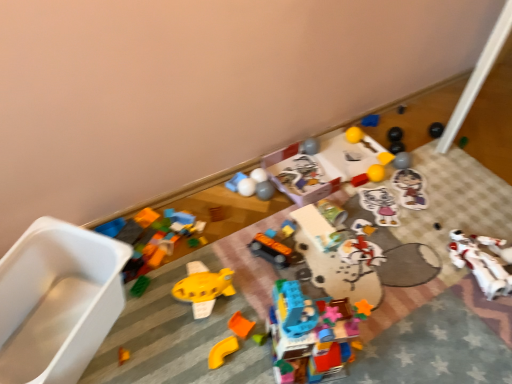
You are a GUI agent. You are given a task and a screenshot of the screen. Output one action in this format:
    pyautogui.click(x=<x>, y=<y>)
    Task: Click on the free space between matte black car at center, the tenth toy positioned from the right, and translucent plastic building blocks at center, the 9th toy positioned from the left
    The width and height of the screenshot is (512, 384).
    Given the screenshot: What is the action you would take?
    279,279